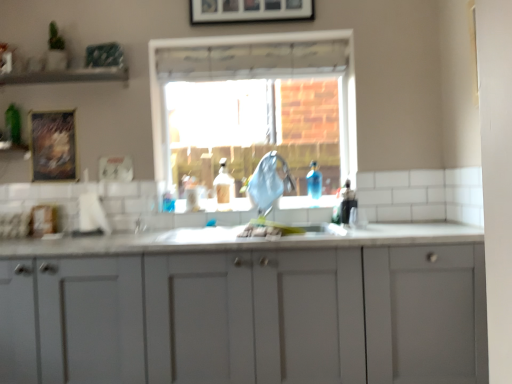
Question: From a real-world perspective, is wooden textured frame at upper left, the 2th picture frame viewed from the front, physically below wooden framed picture at upper center, which is the 2th picture frame in bottom-to-top order?

Choices:
 (A) no
 (B) yes

Answer: (B)

Question: Is wooden textured frame at upper left, which is the first picture frame in left-to-right order, looking in the opposite direction of wooden framed picture at upper center, the second picture frame when ordered from left to right?

Choices:
 (A) no
 (B) yes

Answer: (A)

Question: Is wooden textured frame at upper left, the 2th picture frame when ordered from top to bottom, bigger than wooden framed picture at upper center, acting as the first picture frame starting from the front?

Choices:
 (A) no
 (B) yes

Answer: (A)

Question: From a real-world perspective, is wooden textured frame at upper left, placed as the first picture frame when sorted from bottom to top, physically above wooden framed picture at upper center, acting as the 2th picture frame starting from the back?

Choices:
 (A) yes
 (B) no

Answer: (B)

Question: Is wooden textured frame at upper left, the 2th picture frame when ordered from top to bottom, aimed at wooden framed picture at upper center, acting as the 2th picture frame starting from the back?

Choices:
 (A) no
 (B) yes

Answer: (A)

Question: Considering the relative positions of wooden textured frame at upper left, which is the first picture frame in left-to-right order, and wooden framed picture at upper center, acting as the 2th picture frame starting from the back, in the image provided, is wooden textured frame at upper left, which is the first picture frame in left-to-right order, to the left or to the right of wooden framed picture at upper center, acting as the 2th picture frame starting from the back,?

Choices:
 (A) left
 (B) right

Answer: (A)

Question: From the image's perspective, relative to wooden framed picture at upper center, positioned as the first picture frame in right-to-left order, is wooden textured frame at upper left, which is counted as the first picture frame, starting from the back, above or below?

Choices:
 (A) below
 (B) above

Answer: (A)

Question: Is wooden textured frame at upper left, which is the first picture frame in left-to-right order, taller or shorter than wooden framed picture at upper center, positioned as the first picture frame in right-to-left order?

Choices:
 (A) short
 (B) tall

Answer: (B)

Question: From a real-world perspective, is wooden textured frame at upper left, the 2th picture frame when ordered from top to bottom, physically located above or below wooden framed picture at upper center, which is the 2th picture frame in bottom-to-top order?

Choices:
 (A) above
 (B) below

Answer: (B)

Question: Considering the positions of translucent plastic bottle at center and clear glass window at center in the image, is translucent plastic bottle at center wider or thinner than clear glass window at center?

Choices:
 (A) wide
 (B) thin

Answer: (A)

Question: In the image, is translucent plastic bottle at center positioned in front of or behind clear glass window at center?

Choices:
 (A) behind
 (B) front

Answer: (B)

Question: In the image, is translucent plastic bottle at center on the left side or the right side of clear glass window at center?

Choices:
 (A) left
 (B) right

Answer: (A)

Question: Would you say translucent plastic bottle at center is inside or outside clear glass window at center?

Choices:
 (A) outside
 (B) inside

Answer: (A)

Question: From a real-world perspective, is white matte cabinet at center above or below blue fabric at center?

Choices:
 (A) below
 (B) above

Answer: (A)

Question: Considering their positions, is white matte cabinet at center located in front of or behind blue fabric at center?

Choices:
 (A) front
 (B) behind

Answer: (A)